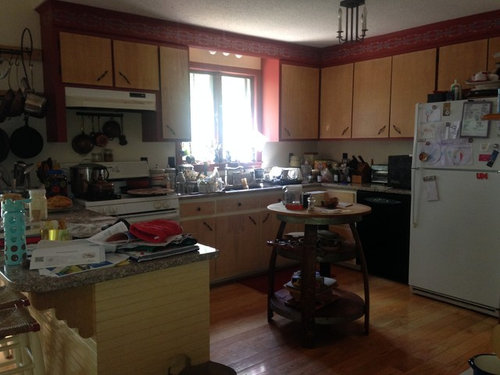
This screenshot has width=500, height=375. I want to click on siding on counter, so click(x=171, y=295).